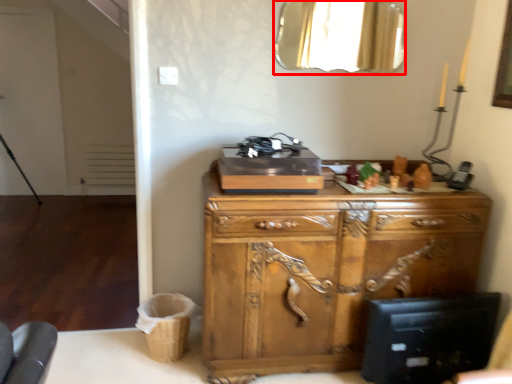
Question: In this image, where is mirror (annotated by the red box) located relative to chest of drawers?

Choices:
 (A) left
 (B) right

Answer: (B)